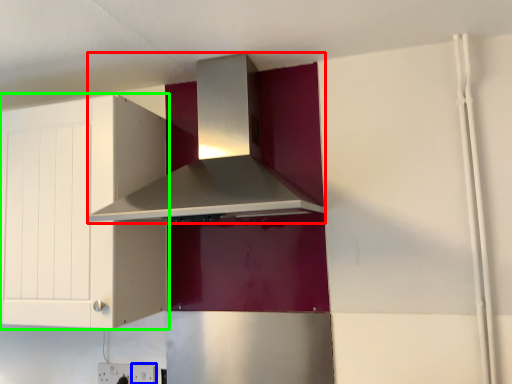
Question: Which is nearer to the home appliance (highlighted by a red box)? electric outlet (highlighted by a blue box) or cabinetry (highlighted by a green box).

Choices:
 (A) electric outlet
 (B) cabinetry

Answer: (B)